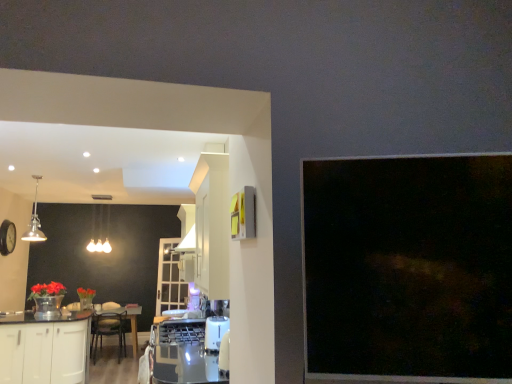
Question: From the image's perspective, is wooden round table at center above clear glass door at center?

Choices:
 (A) no
 (B) yes

Answer: (A)

Question: Is clear glass door at center a part of wooden round table at center?

Choices:
 (A) yes
 (B) no

Answer: (B)

Question: Is wooden round table at center smaller than clear glass door at center?

Choices:
 (A) yes
 (B) no

Answer: (B)

Question: From a real-world perspective, is wooden round table at center over clear glass door at center?

Choices:
 (A) no
 (B) yes

Answer: (A)

Question: Would you consider wooden round table at center to be distant from clear glass door at center?

Choices:
 (A) yes
 (B) no

Answer: (B)

Question: Is wooden round table at center to the left or to the right of matte glass chandelier at upper center in the image?

Choices:
 (A) left
 (B) right

Answer: (B)

Question: From a real-world perspective, is wooden round table at center above or below matte glass chandelier at upper center?

Choices:
 (A) below
 (B) above

Answer: (A)

Question: Considering the positions of wooden round table at center and matte glass chandelier at upper center in the image, is wooden round table at center wider or thinner than matte glass chandelier at upper center?

Choices:
 (A) thin
 (B) wide

Answer: (B)

Question: Relative to matte glass chandelier at upper center, is wooden round table at center in front or behind?

Choices:
 (A) front
 (B) behind

Answer: (A)

Question: Considering the positions of matte glass chandelier at upper center and white glossy cabinetry at lower left in the image, is matte glass chandelier at upper center bigger or smaller than white glossy cabinetry at lower left?

Choices:
 (A) big
 (B) small

Answer: (B)

Question: In the image, is matte glass chandelier at upper center positioned in front of or behind white glossy cabinetry at lower left?

Choices:
 (A) front
 (B) behind

Answer: (B)

Question: Looking at their shapes, would you say matte glass chandelier at upper center is wider or thinner than white glossy cabinetry at lower left?

Choices:
 (A) wide
 (B) thin

Answer: (B)

Question: Is matte glass chandelier at upper center spatially inside white glossy cabinetry at lower left, or outside of it?

Choices:
 (A) inside
 (B) outside

Answer: (B)

Question: From the image's perspective, is wooden round table at center located above or below clear glass door at center?

Choices:
 (A) below
 (B) above

Answer: (A)

Question: Is point (97, 311) positioned closer to the camera than point (175, 289)?

Choices:
 (A) farther
 (B) closer

Answer: (B)